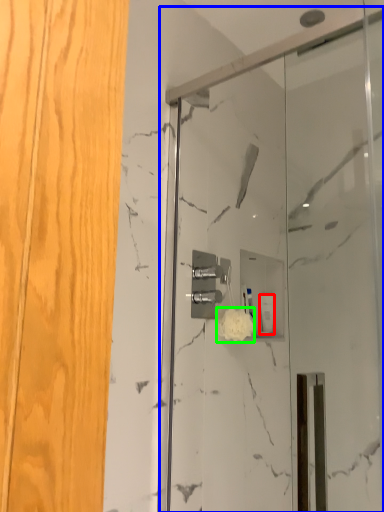
Question: Estimate the real-world distances between objects in this image. Which object is farther from toiletry (highlighted by a red box), screen door (highlighted by a blue box) or flower (highlighted by a green box)?

Choices:
 (A) screen door
 (B) flower

Answer: (A)